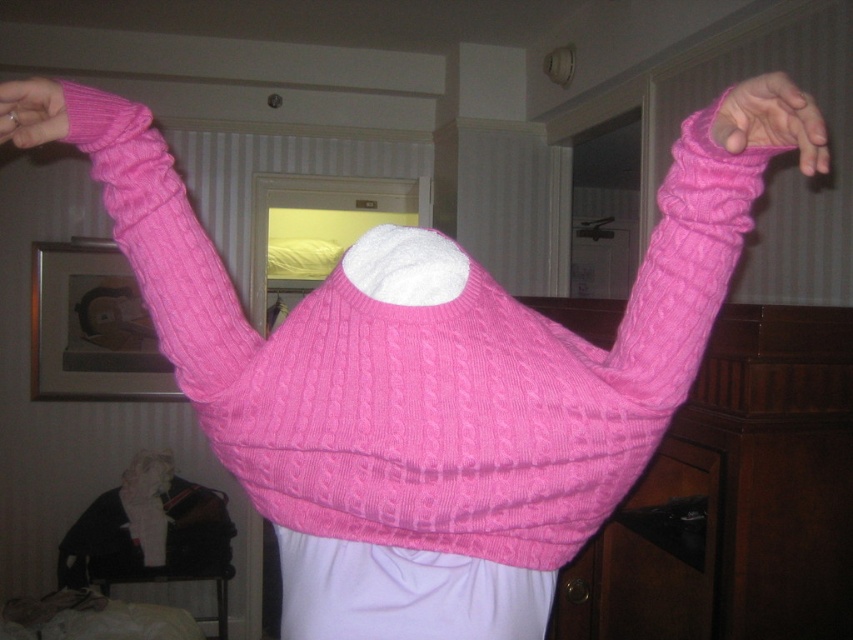
Describe the element at coordinates (772, 120) in the screenshot. I see `pink knitted sweater at upper right` at that location.

Between pink knitted sweater at upper right and matte pink sweater at upper left, which one has more height?

pink knitted sweater at upper right

Does point (770, 138) lie behind point (36, 125)?

That is False.

The width and height of the screenshot is (853, 640). In order to click on pink knitted sweater at upper right in this screenshot , I will do `click(772, 120)`.

In the scene shown: Does cable-knit sweater at upper left have a smaller size compared to matte pink sweater at upper left?

Actually, cable-knit sweater at upper left might be larger than matte pink sweater at upper left.

In the scene shown: Can you confirm if cable-knit sweater at upper left is positioned to the right of matte pink sweater at upper left?

No, cable-knit sweater at upper left is not to the right of matte pink sweater at upper left.

Identify the location of cable-knit sweater at upper left. This screenshot has height=640, width=853. (123, 259).

Looking at this image, is cable-knit sweater at upper left bigger than pink knitted sweater at upper right?

Yes, cable-knit sweater at upper left is bigger than pink knitted sweater at upper right.

Is cable-knit sweater at upper left below pink knitted sweater at upper right?

Indeed, cable-knit sweater at upper left is positioned under pink knitted sweater at upper right.

Does point (143, 180) lie in front of point (735, 134)?

No, it is behind (735, 134).

The width and height of the screenshot is (853, 640). I want to click on cable-knit sweater at upper left, so click(x=123, y=259).